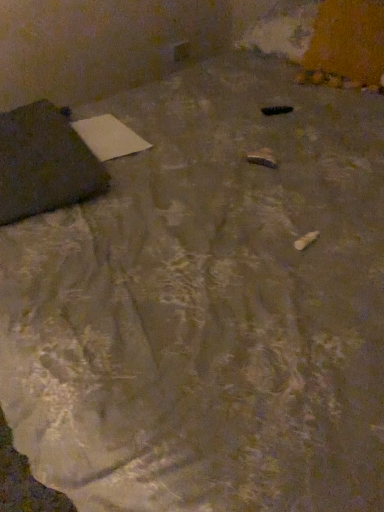
Question: Considering the positions of white paper at upper left and matte black bag at left in the image, is white paper at upper left wider or thinner than matte black bag at left?

Choices:
 (A) thin
 (B) wide

Answer: (A)

Question: Considering the positions of white paper at upper left and matte black bag at left in the image, is white paper at upper left taller or shorter than matte black bag at left?

Choices:
 (A) short
 (B) tall

Answer: (A)

Question: From the image's perspective, is white paper at upper left located above or below matte black bag at left?

Choices:
 (A) above
 (B) below

Answer: (A)

Question: From the image's perspective, is matte black bag at left located above or below white paper at upper left?

Choices:
 (A) below
 (B) above

Answer: (A)

Question: In terms of height, does matte black bag at left look taller or shorter compared to white paper at upper left?

Choices:
 (A) short
 (B) tall

Answer: (B)

Question: From a real-world perspective, is matte black bag at left above or below white paper at upper left?

Choices:
 (A) below
 (B) above

Answer: (B)

Question: Relative to white paper at upper left, is matte black bag at left in front or behind?

Choices:
 (A) front
 (B) behind

Answer: (A)